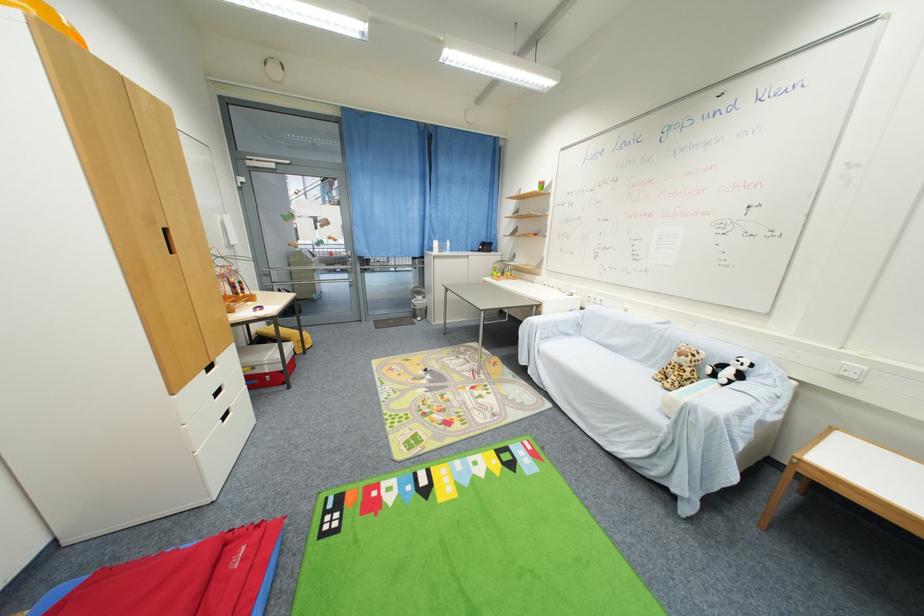
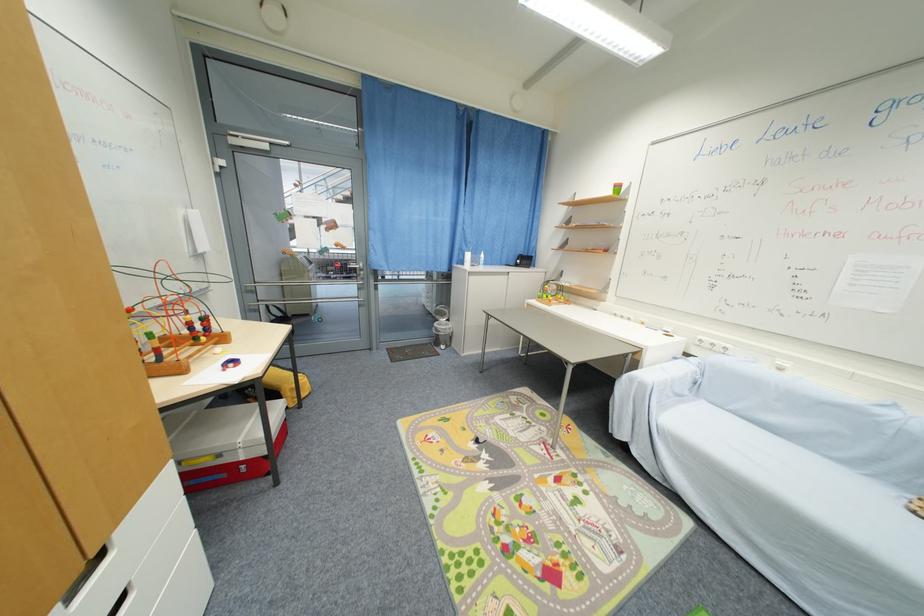
Where in the second image is the point corresponding to pixel 242 296 from the first image?

(201, 341)